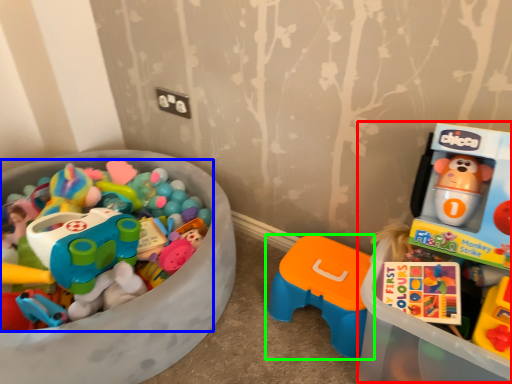
Question: Considering the real-world distances, which object is closest to toyshop (highlighted by a red box)? toy (highlighted by a blue box) or toy (highlighted by a green box).

Choices:
 (A) toy
 (B) toy

Answer: (B)